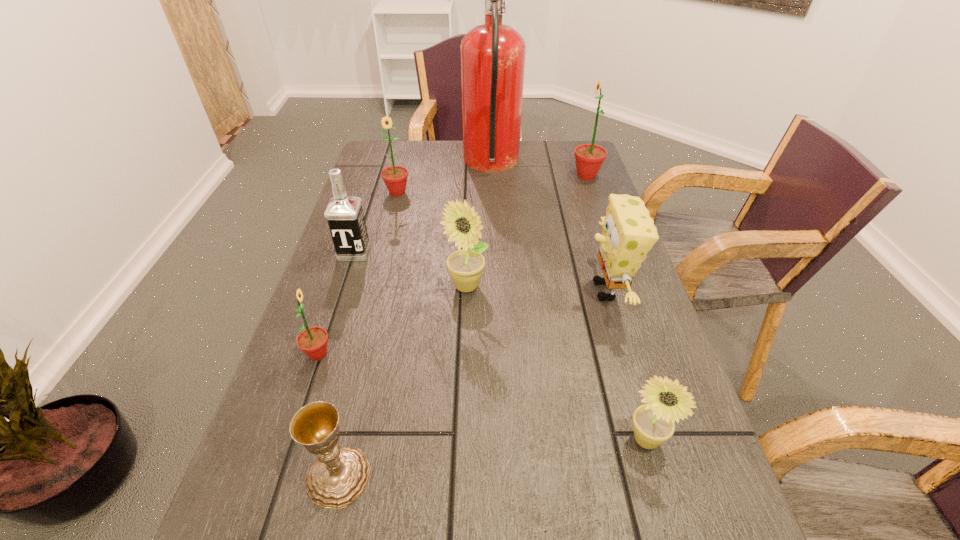
Where is `unoccupied position between the smaller yellow sunflower and the bigger yellow sunflower`? This screenshot has height=540, width=960. unoccupied position between the smaller yellow sunflower and the bigger yellow sunflower is located at coordinates [555, 363].

What are the coordinates of `vacant area that lies between the gold chalice and the smaller yellow sunflower` in the screenshot? It's located at (492, 458).

What are the coordinates of `free space between the fire extinguisher and the vodka` in the screenshot? It's located at (422, 208).

Locate an element on the screen. vacant space that's between the second farthest sunflower and the fourth farthest sunflower is located at coordinates (358, 273).

This screenshot has height=540, width=960. What are the coordinates of `object that can be found as the second closest to the yellow sponge` in the screenshot? It's located at (462, 224).

I want to click on object identified as the second closest to the bigger yellow sunflower, so tap(628, 232).

Point out which sunflower is positioned as the third nearest to the farthest sunflower. Please provide its 2D coordinates. Your answer should be formatted as a tuple, i.e. [(x, y)], where the tuple contains the x and y coordinates of a point satisfying the conditions above.

[(653, 423)]

Choose which sunflower is the fourth nearest neighbor to the sponge. Please provide its 2D coordinates. Your answer should be formatted as a tuple, i.e. [(x, y)], where the tuple contains the x and y coordinates of a point satisfying the conditions above.

[(395, 177)]

Where is `green sunflower that is the third closest to the yellow sponge`? green sunflower that is the third closest to the yellow sponge is located at coordinates (312, 341).

Identify which green sunflower is the third nearest to the gold chalice. Please provide its 2D coordinates. Your answer should be formatted as a tuple, i.e. [(x, y)], where the tuple contains the x and y coordinates of a point satisfying the conditions above.

[(589, 157)]